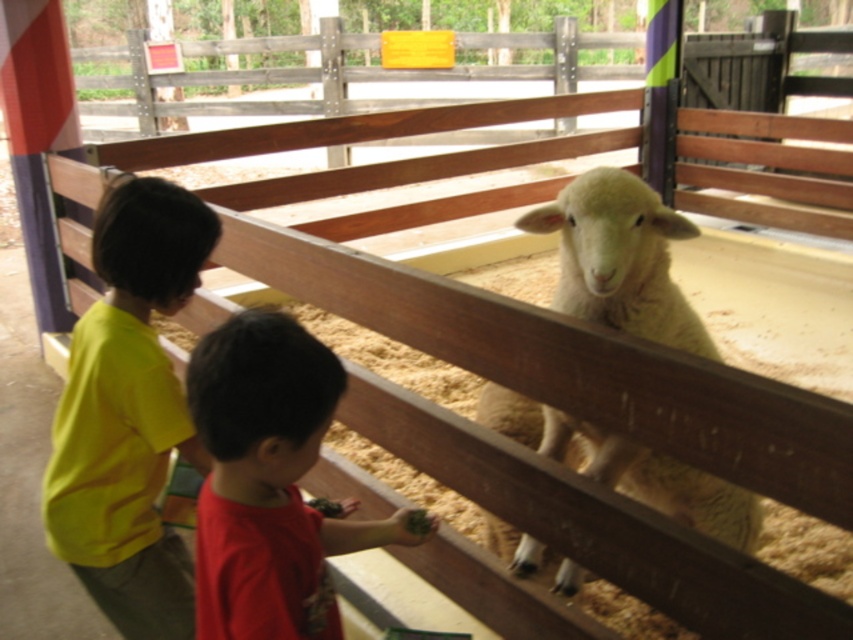
Question: Which point appears farthest from the camera in this image?

Choices:
 (A) (86, 346)
 (B) (624, 257)
 (C) (245, 497)

Answer: (B)

Question: Is red cotton shirt at lower center wider than white woolen sheep at center?

Choices:
 (A) yes
 (B) no

Answer: (B)

Question: Which is nearer to the white woolen sheep at center?

Choices:
 (A) red cotton shirt at lower center
 (B) yellow matte shirt at left

Answer: (A)

Question: Is red cotton shirt at lower center smaller than white woolen sheep at center?

Choices:
 (A) yes
 (B) no

Answer: (A)

Question: Can you confirm if red cotton shirt at lower center is positioned to the right of white woolen sheep at center?

Choices:
 (A) yes
 (B) no

Answer: (B)

Question: Which point is farther to the camera?

Choices:
 (A) red cotton shirt at lower center
 (B) white woolen sheep at center

Answer: (B)